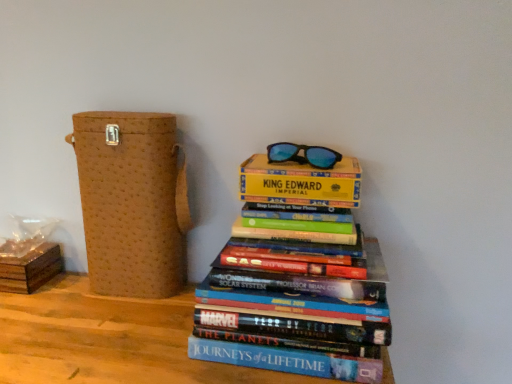
Question: From the image's perspective, is hardcover books at center positioned above or below brown textured box at left, the second cardboard box in the left-to-right sequence?

Choices:
 (A) below
 (B) above

Answer: (A)

Question: Visually, is hardcover books at center positioned to the left or to the right of brown textured box at left, the first cardboard box from the right?

Choices:
 (A) left
 (B) right

Answer: (B)

Question: Estimate the real-world distances between objects in this image. Which object is farther from the brown textured box at left, the second cardboard box in the left-to-right sequence?

Choices:
 (A) brown cardboard box at lower left, the 2th cardboard box from the right
 (B) hardcover books at center
 (C) blue reflective lenses at upper center

Answer: (C)

Question: Estimate the real-world distances between objects in this image. Which object is closer to the brown cardboard box at lower left, the 2th cardboard box from the right?

Choices:
 (A) blue reflective lenses at upper center
 (B) brown textured box at left, the first cardboard box from the right
 (C) hardcover books at center

Answer: (B)